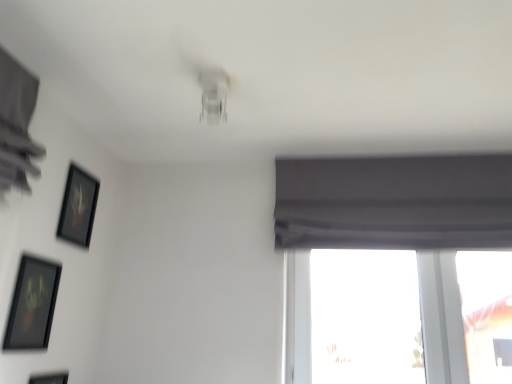
Locate an element on the screen. The height and width of the screenshot is (384, 512). matte black picture frame at lower left, which ranks as the first picture frame in bottom-to-top order is located at coordinates (49, 378).

In order to click on black matte picture frame at upper left, which is the third picture frame from bottom to top in this screenshot , I will do `click(78, 207)`.

At what (x,y) coordinates should I click in order to perform the action: click on transparent glass window at lower right. Please return your answer as a coordinate pair (x, y). This screenshot has height=384, width=512. Looking at the image, I should click on (365, 318).

Measure the distance between point (x=50, y=295) and camera.

A distance of 1.68 meters exists between point (x=50, y=295) and camera.

Describe the element at coordinates (32, 305) in the screenshot. I see `matte black picture frame at lower left, which is the second picture frame from bottom to top` at that location.

What do you see at coordinates (394, 202) in the screenshot? I see `gray matte curtain at upper right` at bounding box center [394, 202].

The height and width of the screenshot is (384, 512). In order to click on matte black picture frame at lower left, which ranks as the 3th picture frame in top-to-bottom order in this screenshot , I will do `click(49, 378)`.

Which of these two, matte black picture frame at lower left, which ranks as the 3th picture frame in top-to-bottom order, or transparent glass window at lower right, is thinner?

With smaller width is matte black picture frame at lower left, which ranks as the 3th picture frame in top-to-bottom order.

In terms of height, does matte black picture frame at lower left, which ranks as the first picture frame in bottom-to-top order, look taller or shorter compared to transparent glass window at lower right?

Clearly, matte black picture frame at lower left, which ranks as the first picture frame in bottom-to-top order, is shorter compared to transparent glass window at lower right.

Is matte black picture frame at lower left, which ranks as the 3th picture frame in top-to-bottom order, closer to the viewer compared to transparent glass window at lower right?

Yes, it is.

Is matte black picture frame at lower left, which ranks as the first picture frame in bottom-to-top order, completely or partially outside of transparent glass window at lower right?

matte black picture frame at lower left, which ranks as the first picture frame in bottom-to-top order, is positioned outside transparent glass window at lower right.

In terms of width, does transparent glass window at lower right look wider or thinner when compared to matte black picture frame at lower left, which is counted as the second picture frame, starting from the top?

Considering their sizes, transparent glass window at lower right looks broader than matte black picture frame at lower left, which is counted as the second picture frame, starting from the top.

Is transparent glass window at lower right placed right next to matte black picture frame at lower left, which is counted as the second picture frame, starting from the top?

No.

Is transparent glass window at lower right facing towards matte black picture frame at lower left, which is counted as the second picture frame, starting from the top?

No, transparent glass window at lower right is not aimed at matte black picture frame at lower left, which is counted as the second picture frame, starting from the top.

Based on the photo, is transparent glass window at lower right located outside matte black picture frame at lower left, which is counted as the second picture frame, starting from the top?

Absolutely, transparent glass window at lower right is external to matte black picture frame at lower left, which is counted as the second picture frame, starting from the top.

Considering the sizes of objects gray matte curtain at upper right and matte black picture frame at lower left, which ranks as the 3th picture frame in top-to-bottom order, in the image provided, who is smaller, gray matte curtain at upper right or matte black picture frame at lower left, which ranks as the 3th picture frame in top-to-bottom order,?

matte black picture frame at lower left, which ranks as the 3th picture frame in top-to-bottom order, is smaller.

How many degrees apart are the facing directions of gray matte curtain at upper right and matte black picture frame at lower left, which ranks as the first picture frame in bottom-to-top order?

gray matte curtain at upper right and matte black picture frame at lower left, which ranks as the first picture frame in bottom-to-top order, are facing 90.3 degrees away from each other.

From the image's perspective, relative to matte black picture frame at lower left, which ranks as the 3th picture frame in top-to-bottom order, is gray matte curtain at upper right above or below?

gray matte curtain at upper right is situated higher than matte black picture frame at lower left, which ranks as the 3th picture frame in top-to-bottom order, in the image.

Is gray matte curtain at upper right closer to the viewer compared to matte black picture frame at lower left, which ranks as the 3th picture frame in top-to-bottom order?

No, gray matte curtain at upper right is further to the viewer.

How distant is matte black picture frame at lower left, which ranks as the first picture frame in bottom-to-top order, from matte black picture frame at lower left, which is counted as the second picture frame, starting from the top?

matte black picture frame at lower left, which ranks as the first picture frame in bottom-to-top order, is 10.67 inches from matte black picture frame at lower left, which is counted as the second picture frame, starting from the top.

Who is shorter, matte black picture frame at lower left, which ranks as the first picture frame in bottom-to-top order, or matte black picture frame at lower left, which is counted as the second picture frame, starting from the top?

matte black picture frame at lower left, which is counted as the second picture frame, starting from the top, is shorter.

Is matte black picture frame at lower left, which ranks as the 3th picture frame in top-to-bottom order, next to matte black picture frame at lower left, which is the second picture frame from bottom to top, and touching it?

matte black picture frame at lower left, which ranks as the 3th picture frame in top-to-bottom order, is not next to matte black picture frame at lower left, which is the second picture frame from bottom to top, and they're not touching.

Looking at their sizes, would you say black matte picture frame at upper left, the 1th picture frame from the top, is wider or thinner than matte black picture frame at lower left, which is counted as the second picture frame, starting from the top?

Clearly, black matte picture frame at upper left, the 1th picture frame from the top, has more width compared to matte black picture frame at lower left, which is counted as the second picture frame, starting from the top.

Could you measure the distance between black matte picture frame at upper left, which is the third picture frame from bottom to top, and matte black picture frame at lower left, which is the second picture frame from bottom to top?

11.49 inches.

Is black matte picture frame at upper left, the 1th picture frame from the top, to the right of matte black picture frame at lower left, which is counted as the second picture frame, starting from the top, from the viewer's perspective?

Indeed, black matte picture frame at upper left, the 1th picture frame from the top, is positioned on the right side of matte black picture frame at lower left, which is counted as the second picture frame, starting from the top.

Based on the photo, who is shorter, black matte picture frame at upper left, which is the third picture frame from bottom to top, or matte black picture frame at lower left, which is counted as the second picture frame, starting from the top?

black matte picture frame at upper left, which is the third picture frame from bottom to top.

From the picture: What's the angular difference between gray matte curtain at upper right and black matte picture frame at upper left, which is the third picture frame from bottom to top,'s facing directions?

90.3 degrees separate the facing orientations of gray matte curtain at upper right and black matte picture frame at upper left, which is the third picture frame from bottom to top.

From the image's perspective, between gray matte curtain at upper right and black matte picture frame at upper left, the 1th picture frame from the top, which one is located above?

gray matte curtain at upper right.

Is gray matte curtain at upper right looking in the opposite direction of black matte picture frame at upper left, which is the third picture frame from bottom to top?

No, gray matte curtain at upper right is not facing the opposite direction of black matte picture frame at upper left, which is the third picture frame from bottom to top.

From a real-world perspective, is gray matte curtain at upper right positioned over black matte picture frame at upper left, the 1th picture frame from the top, based on gravity?

Yes.

From a real-world perspective, between matte black picture frame at lower left, which is the second picture frame from bottom to top, and gray matte curtain at upper right, who is vertically higher?

gray matte curtain at upper right, from a real-world perspective.

Does matte black picture frame at lower left, which is counted as the second picture frame, starting from the top, touch gray matte curtain at upper right?

No, matte black picture frame at lower left, which is counted as the second picture frame, starting from the top, is not with gray matte curtain at upper right.

Can you confirm if matte black picture frame at lower left, which is counted as the second picture frame, starting from the top, is thinner than gray matte curtain at upper right?

Yes, matte black picture frame at lower left, which is counted as the second picture frame, starting from the top, is thinner than gray matte curtain at upper right.

Which is behind, point (52, 291) or point (369, 168)?

The point (369, 168) is farther from the camera.

The width and height of the screenshot is (512, 384). Find the location of `the 2nd picture frame to the left of the transparent glass window at lower right, counting from the anchor's position`. the 2nd picture frame to the left of the transparent glass window at lower right, counting from the anchor's position is located at coordinates (49, 378).

The width and height of the screenshot is (512, 384). In order to click on window behind the matte black picture frame at lower left, which is the second picture frame from bottom to top in this screenshot , I will do `click(365, 318)`.

Estimate the real-world distances between objects in this image. Which object is further from black matte picture frame at upper left, which is the third picture frame from bottom to top, matte black picture frame at lower left, which is counted as the second picture frame, starting from the top, or matte black picture frame at lower left, which ranks as the first picture frame in bottom-to-top order?

matte black picture frame at lower left, which ranks as the first picture frame in bottom-to-top order, is further to black matte picture frame at upper left, which is the third picture frame from bottom to top.

Estimate the real-world distances between objects in this image. Which object is closer to transparent glass window at lower right, matte black picture frame at lower left, which is the second picture frame from bottom to top, or black matte picture frame at upper left, the 1th picture frame from the top?

black matte picture frame at upper left, the 1th picture frame from the top.

Considering their positions, is transparent glass window at lower right positioned further to matte black picture frame at lower left, which is counted as the second picture frame, starting from the top, than gray matte curtain at upper right?

transparent glass window at lower right is positioned further to the anchor matte black picture frame at lower left, which is counted as the second picture frame, starting from the top.

Which object lies further to the anchor point matte black picture frame at lower left, which is counted as the second picture frame, starting from the top, black matte picture frame at upper left, which is the third picture frame from bottom to top, or matte black picture frame at lower left, which ranks as the first picture frame in bottom-to-top order?

Based on the image, black matte picture frame at upper left, which is the third picture frame from bottom to top, appears to be further to matte black picture frame at lower left, which is counted as the second picture frame, starting from the top.

Looking at the image, which one is located further to black matte picture frame at upper left, the 1th picture frame from the top, gray matte curtain at upper right or matte black picture frame at lower left, which ranks as the first picture frame in bottom-to-top order?

gray matte curtain at upper right is positioned further to the anchor black matte picture frame at upper left, the 1th picture frame from the top.

Considering their positions, is gray matte curtain at upper right positioned closer to matte black picture frame at lower left, which is the second picture frame from bottom to top, than matte black picture frame at lower left, which ranks as the first picture frame in bottom-to-top order?

matte black picture frame at lower left, which ranks as the first picture frame in bottom-to-top order, lies closer to matte black picture frame at lower left, which is the second picture frame from bottom to top, than the other object.

Which object lies further to the anchor point matte black picture frame at lower left, which is counted as the second picture frame, starting from the top, matte black picture frame at lower left, which ranks as the 3th picture frame in top-to-bottom order, or transparent glass window at lower right?

Among the two, transparent glass window at lower right is located further to matte black picture frame at lower left, which is counted as the second picture frame, starting from the top.

Estimate the real-world distances between objects in this image. Which object is closer to matte black picture frame at lower left, which is the second picture frame from bottom to top, black matte picture frame at upper left, the 1th picture frame from the top, or gray matte curtain at upper right?

black matte picture frame at upper left, the 1th picture frame from the top, is positioned closer to the anchor matte black picture frame at lower left, which is the second picture frame from bottom to top.

What are the coordinates of `window between black matte picture frame at upper left, the 1th picture frame from the top, and gray matte curtain at upper right, in the horizontal direction` in the screenshot? It's located at (365, 318).

You are a GUI agent. You are given a task and a screenshot of the screen. Output one action in this format:
    pyautogui.click(x=<x>, y=<y>)
    Task: Click on the picture frame between matte black picture frame at lower left, which ranks as the 3th picture frame in top-to-bottom order, and transparent glass window at lower right
    The width and height of the screenshot is (512, 384).
    Given the screenshot: What is the action you would take?
    pyautogui.click(x=78, y=207)

I want to click on window between matte black picture frame at lower left, which is counted as the second picture frame, starting from the top, and gray matte curtain at upper right from left to right, so click(365, 318).

Image resolution: width=512 pixels, height=384 pixels. In order to click on picture frame between matte black picture frame at lower left, which ranks as the 3th picture frame in top-to-bottom order, and gray matte curtain at upper right, in the horizontal direction in this screenshot , I will do `click(78, 207)`.